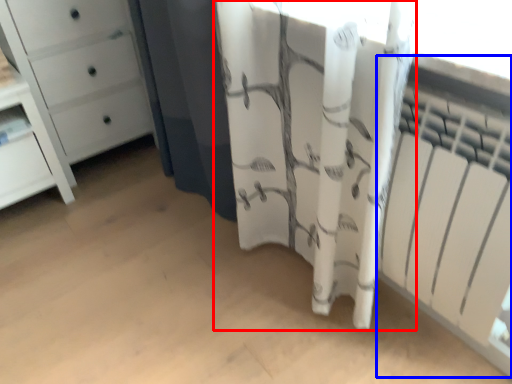
Question: Which object is closer to the camera taking this photo, curtain (highlighted by a red box) or radiator (highlighted by a blue box)?

Choices:
 (A) curtain
 (B) radiator

Answer: (A)